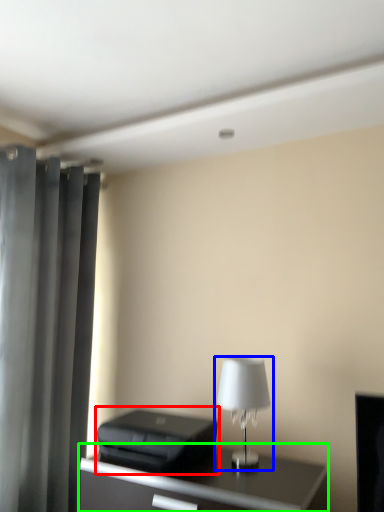
Question: Which object is the farthest from printer (highlighted by a red box)? Choose among these: lamp (highlighted by a blue box) or table (highlighted by a green box).

Choices:
 (A) lamp
 (B) table

Answer: (A)